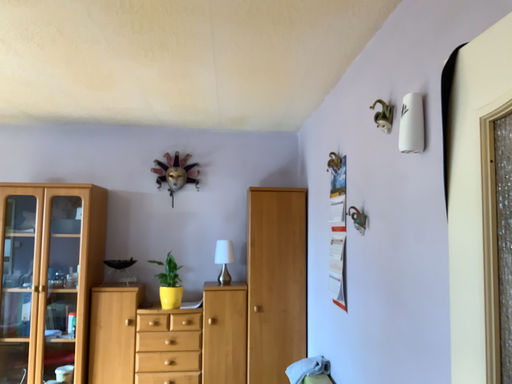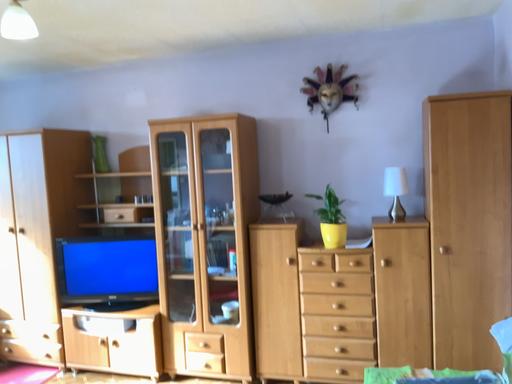
Question: How did the camera likely rotate when shooting the video?

Choices:
 (A) rotated right
 (B) rotated left

Answer: (B)